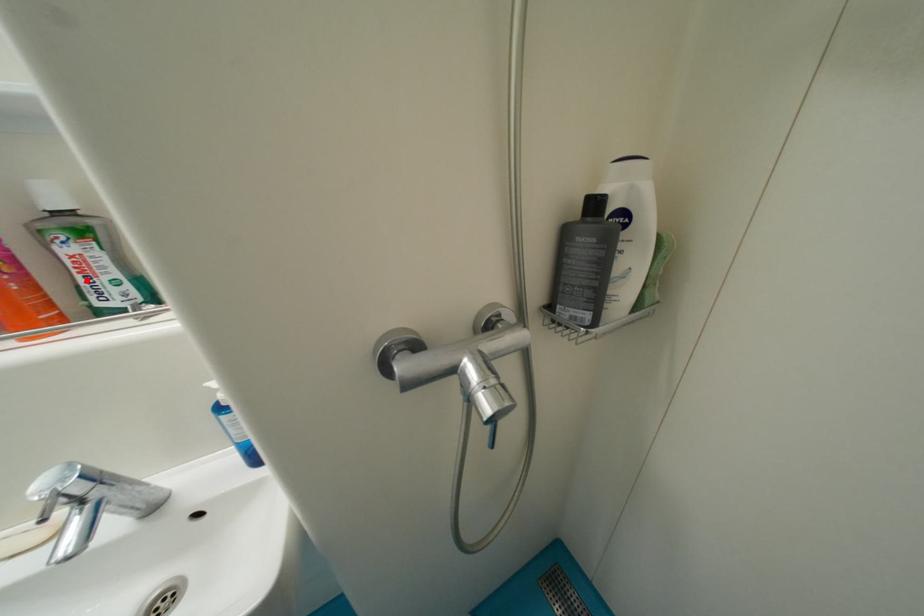
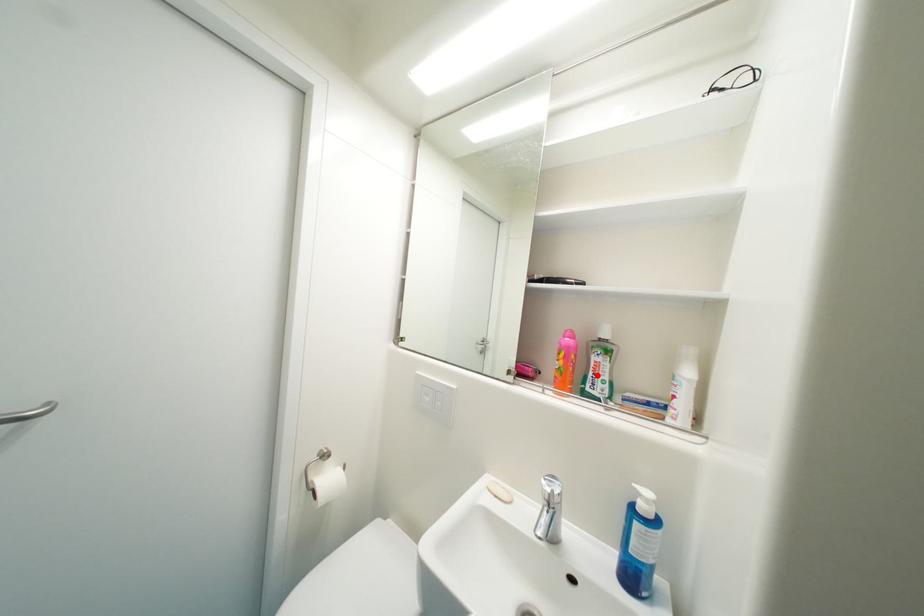
I am providing you with two images of the same scene from different viewpoints. A red point is marked on the first image and another point is marked on the second image. Do the highlighted points in image1 and image2 indicate the same real-world spot?

Yes